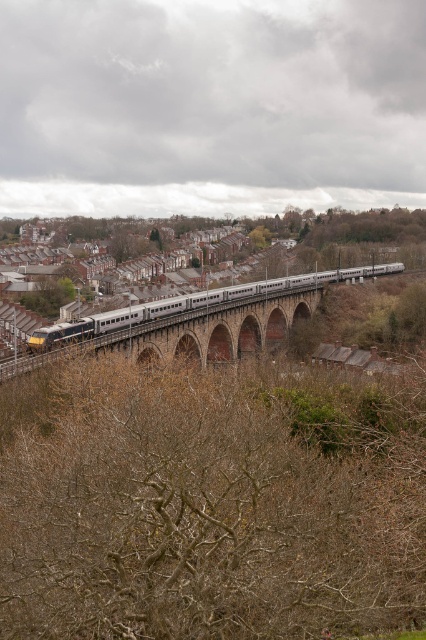
In the scene shown: Is brown stone arch bridge at center to the left of green leafy tree at lower left from the viewer's perspective?

Incorrect, brown stone arch bridge at center is not on the left side of green leafy tree at lower left.

Does brown stone arch bridge at center have a lesser width compared to green leafy tree at lower left?

In fact, brown stone arch bridge at center might be wider than green leafy tree at lower left.

Between point (161, 337) and point (32, 300), which one is positioned in front?

Positioned in front is point (161, 337).

The image size is (426, 640). I want to click on brown stone arch bridge at center, so click(x=215, y=330).

In the scene shown: Does silver metallic train at center lie behind green leafy tree at lower left?

No, silver metallic train at center is closer to the viewer.

Which of these two, silver metallic train at center or green leafy tree at lower left, stands taller?

With more height is silver metallic train at center.

Find the location of a particular element. This screenshot has width=426, height=640. silver metallic train at center is located at coordinates (198, 304).

Can you confirm if brown stone arch bridge at center is taller than silver metallic train at center?

No, brown stone arch bridge at center is not taller than silver metallic train at center.

Who is lower down, brown stone arch bridge at center or silver metallic train at center?

brown stone arch bridge at center

Describe the element at coordinates (215, 330) in the screenshot. The width and height of the screenshot is (426, 640). I see `brown stone arch bridge at center` at that location.

The image size is (426, 640). I want to click on brown stone arch bridge at center, so click(x=215, y=330).